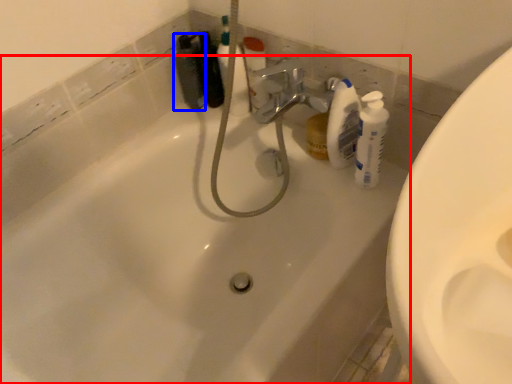
Question: Which point is closer to the camera, bathtub (highlighted by a red box) or toiletry (highlighted by a blue box)?

Choices:
 (A) bathtub
 (B) toiletry

Answer: (A)